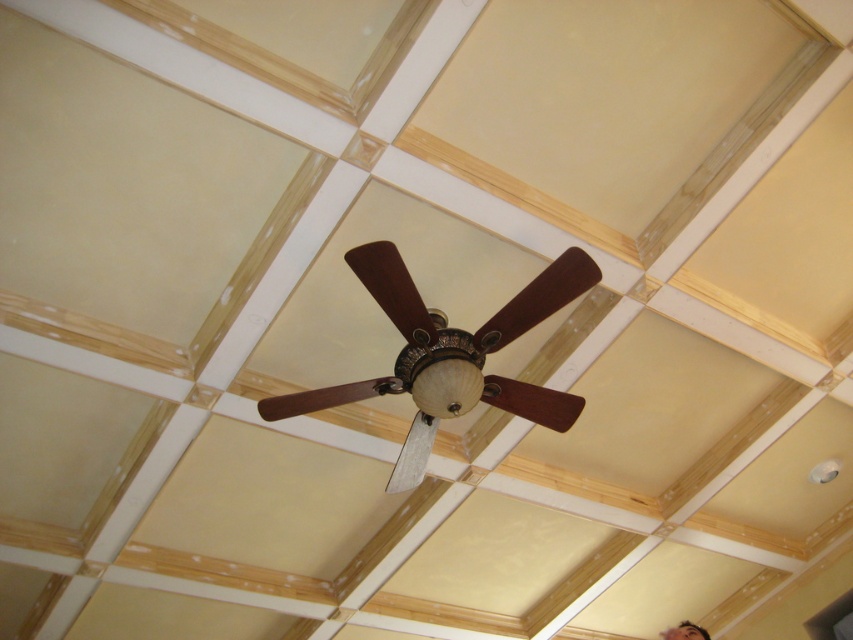
Question: Is wooden ceiling fan at center further to the viewer compared to smooth skin face at lower right?

Choices:
 (A) no
 (B) yes

Answer: (A)

Question: Observing the image, what is the correct spatial positioning of wooden ceiling fan at center in reference to smooth skin face at lower right?

Choices:
 (A) left
 (B) right

Answer: (A)

Question: Which of the following is the farthest from the observer?

Choices:
 (A) smooth skin face at lower right
 (B) wooden ceiling fan at center

Answer: (A)

Question: Which point appears closest to the camera in this image?

Choices:
 (A) (550, 291)
 (B) (682, 625)

Answer: (A)

Question: Which object is farther from the camera taking this photo?

Choices:
 (A) wooden ceiling fan at center
 (B) smooth skin face at lower right

Answer: (B)

Question: Is wooden ceiling fan at center wider than smooth skin face at lower right?

Choices:
 (A) yes
 (B) no

Answer: (A)